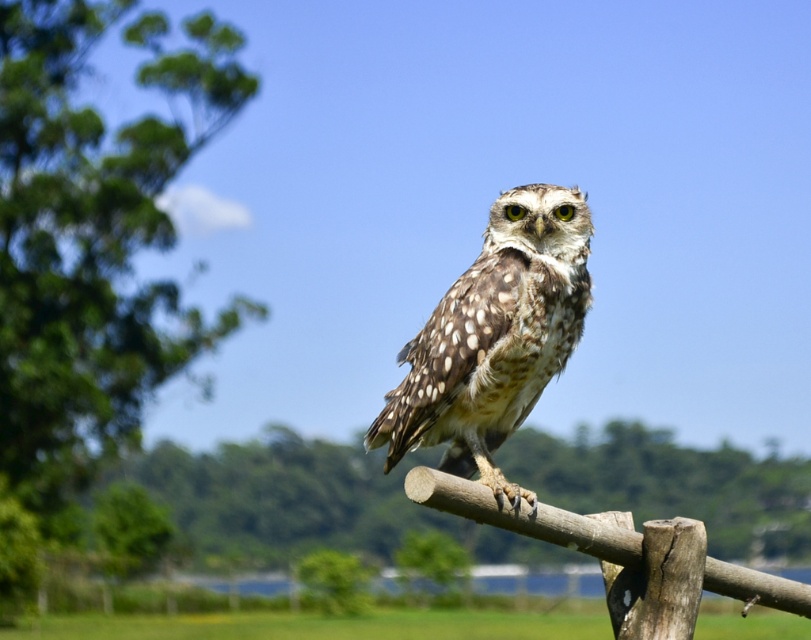
Question: Is green leafy tree at upper left to the left of speckled feathered owl at center from the viewer's perspective?

Choices:
 (A) no
 (B) yes

Answer: (B)

Question: Which point is closer to the camera taking this photo?

Choices:
 (A) (732, 580)
 (B) (187, 51)
 (C) (573, 236)

Answer: (C)

Question: Does green leafy tree at upper left appear on the right side of brown rough wood at center?

Choices:
 (A) no
 (B) yes

Answer: (A)

Question: Does speckled feathered owl at center have a greater width compared to brown rough wood at center?

Choices:
 (A) no
 (B) yes

Answer: (A)

Question: Which object is positioned farthest from the green leafy tree at upper left?

Choices:
 (A) speckled feathered owl at center
 (B) brown rough wood at center

Answer: (A)

Question: Which point is closer to the camera?

Choices:
 (A) speckled feathered owl at center
 (B) green leafy tree at upper left
 (C) brown rough wood at center

Answer: (C)